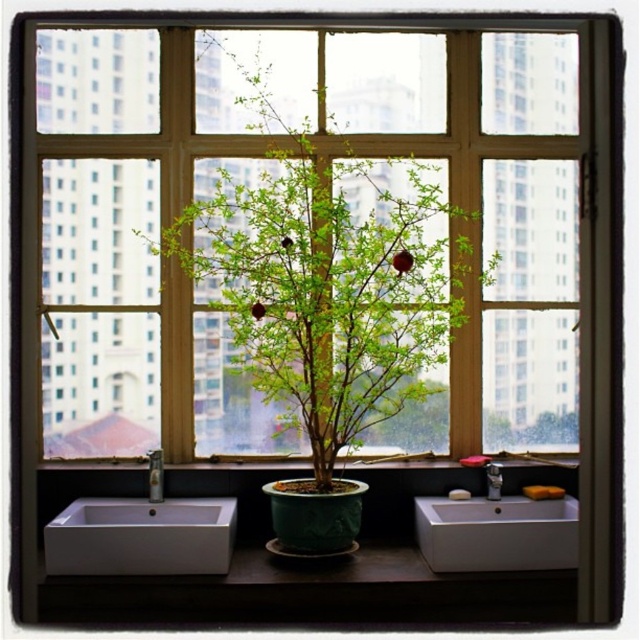
You are a guest in this room and want to place a small vase between the green ceramic plant at center and the white glossy sink at lower center. Based on their positions, where should you place the vase?

The green ceramic plant at center is to the left of the white glossy sink at lower center, so you should place the vase between them on the right side of the plant and the left side of the sink.

You are a houseplant enthusiast who wants to place a new plant between the green ceramic pot at center and the white ceramic faucet at center. Which side of the faucet should you place it on to keep it aligned with the existing arrangement?

The green ceramic pot at center is already to the right of the white ceramic faucet at center, so placing the new plant to the right of the faucet would maintain alignment with the existing arrangement.